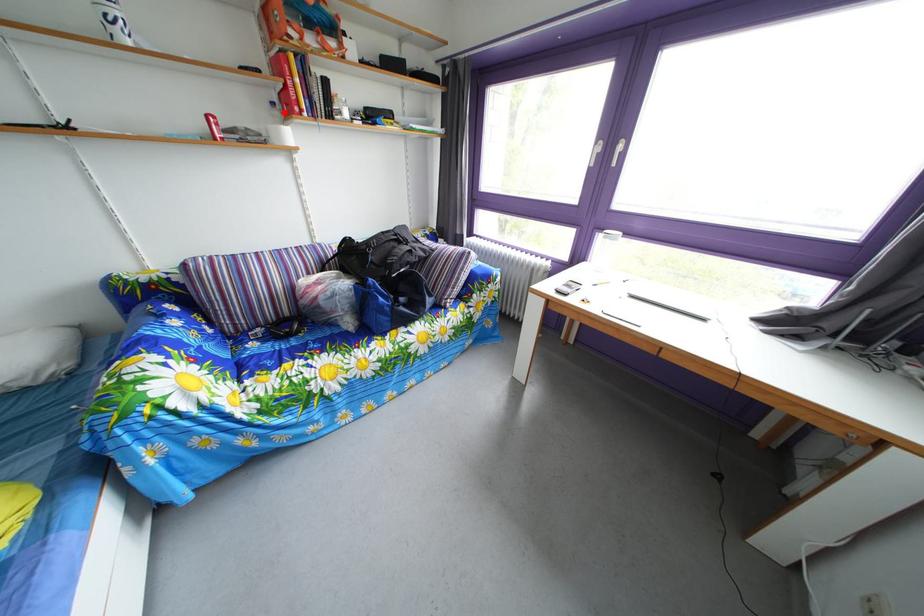
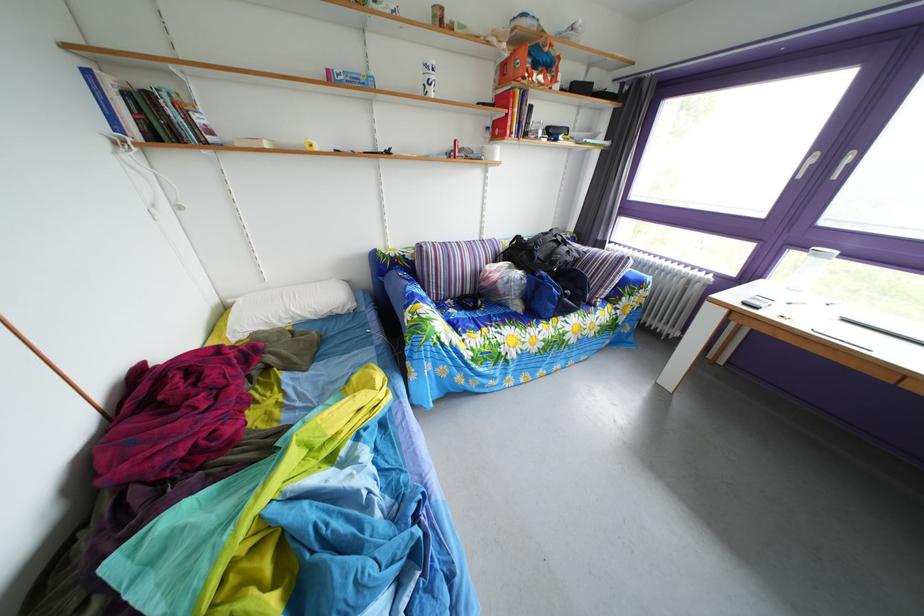
Question: A red point is marked in image1. In image2, is the corresponding 3D point closer to the camera or farther? Reply with the corresponding letter.

Choices:
 (A) The corresponding 3D point is closer.
 (B) The corresponding 3D point is farther.

Answer: (A)